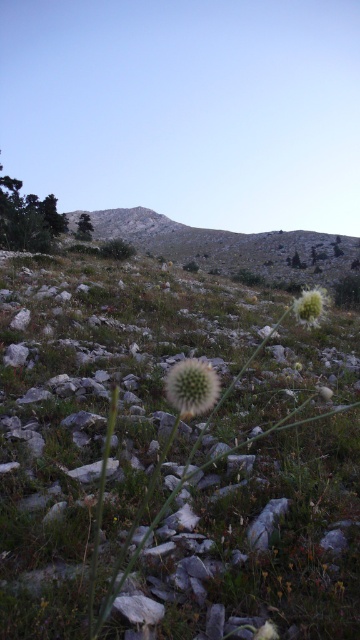
Question: Is bare rock at upper center wider than white fuzzy ball at center?

Choices:
 (A) no
 (B) yes

Answer: (B)

Question: Which object appears closest to the camera in this image?

Choices:
 (A) white fuzzy ball at upper right
 (B) white fuzzy ball at center

Answer: (B)

Question: Is bare rock at upper center below white fuzzy ball at upper right?

Choices:
 (A) yes
 (B) no

Answer: (B)

Question: Based on their relative distances, which object is farther from the white fuzzy ball at upper right?

Choices:
 (A) bare rock at upper center
 (B) white fuzzy ball at center

Answer: (A)

Question: Is bare rock at upper center positioned at the back of white fuzzy ball at center?

Choices:
 (A) no
 (B) yes

Answer: (B)

Question: Which point appears closest to the camera in this image?

Choices:
 (A) (171, 404)
 (B) (204, 262)

Answer: (A)